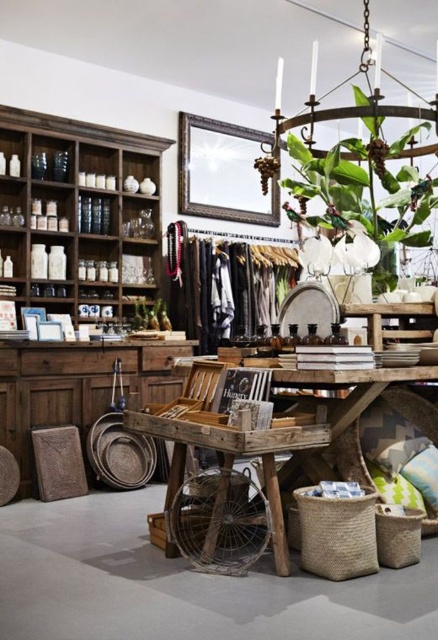
From the picture: You are an interior designer planning to move the green leafy plant at upper center closer to the dark brown wood shelves at upper left. Based on their current positions, which object would you need to move first to make space?

The green leafy plant at upper center is behind the dark brown wood shelves at upper left, so you would need to move the dark brown wood shelves at upper left first to make space.

You are standing in the shop and want to move from the wooden cart to the back wall. Which point, point (169, 541) or point (426, 504), is closer to the back wall?

Point (426, 504) is closer to the back wall because it is behind point (169, 541).